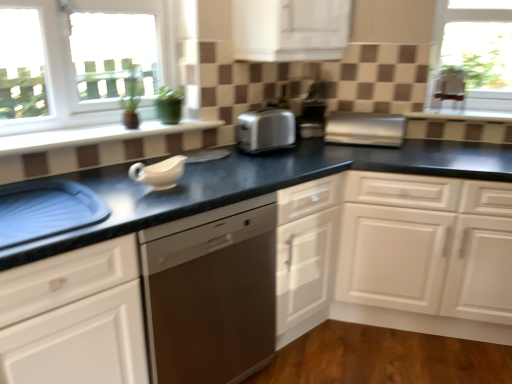
At what (x,y) coordinates should I click in order to perform the action: click on blank space situated above blue plastic tray at lower left (from a real-world perspective). Please return your answer as a coordinate pair (x, y). This screenshot has width=512, height=384. Looking at the image, I should click on (41, 207).